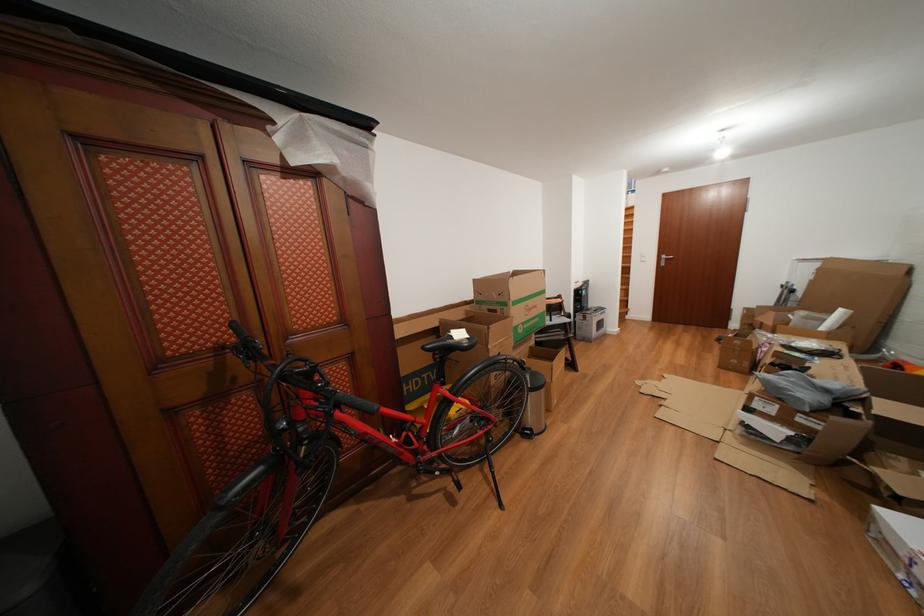
Image resolution: width=924 pixels, height=616 pixels. Describe the element at coordinates (450, 342) in the screenshot. I see `the black bicycle seat` at that location.